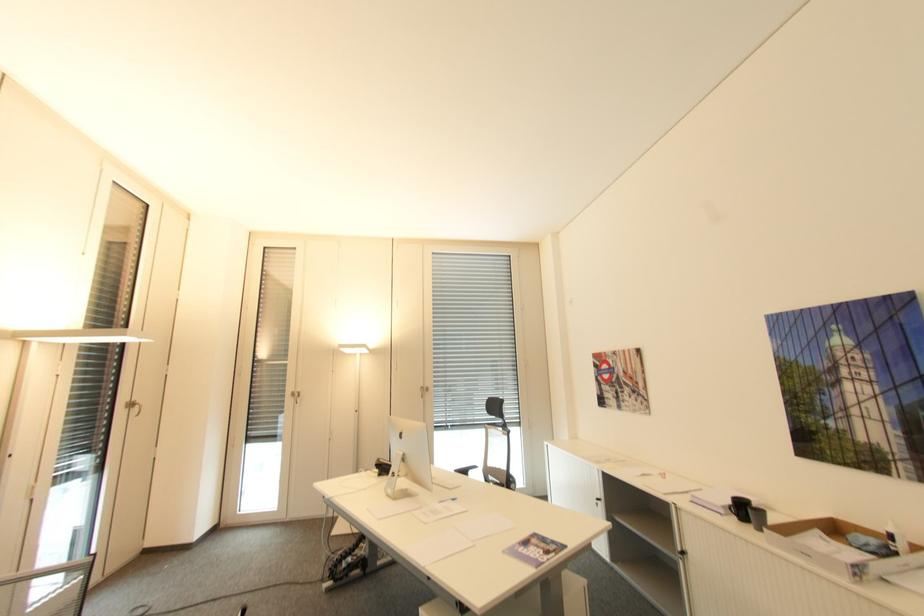
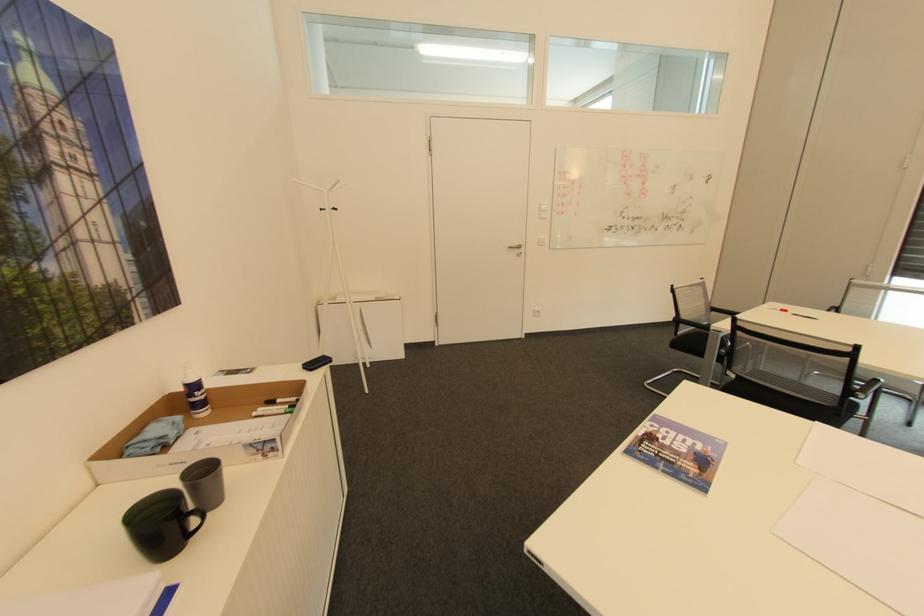
Where in the second image is the point corresponding to (894,530) from the first image?

(197, 379)